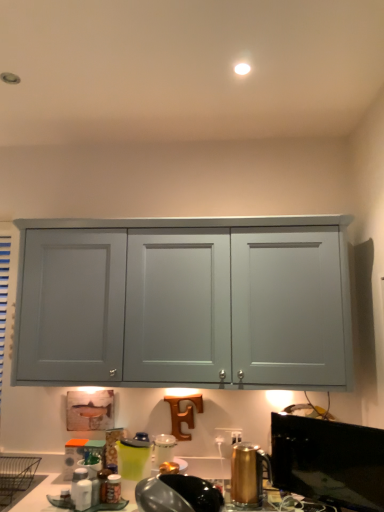
Question: From the image's perspective, relative to black glossy window screen at lower right, is matte plastic container at lower left, acting as the fourth appliance starting from the front, above or below?

Choices:
 (A) above
 (B) below

Answer: (B)

Question: Choose the correct answer: Is matte plastic container at lower left, arranged as the 1th appliance when viewed from the left, inside black glossy window screen at lower right or outside it?

Choices:
 (A) outside
 (B) inside

Answer: (A)

Question: Considering the real-world distances, which object is closest to the metallic silver toaster at lower center, the 2th appliance when ordered from right to left?

Choices:
 (A) matte plastic container at lower left, which appears as the 1th appliance when viewed from the back
 (B) black glossy window screen at lower right
 (C) gold metallic kettle at lower right, the 2th appliance viewed from the front
 (D) green plastic pitcher at lower center, acting as the second appliance starting from the left

Answer: (D)

Question: Which of these objects is positioned farthest from the gold metallic kettle at lower right, the 1th appliance in the right-to-left sequence?

Choices:
 (A) matte plastic container at lower left, arranged as the 1th appliance when viewed from the left
 (B) green plastic pitcher at lower center, the 3th appliance when ordered from right to left
 (C) black glossy window screen at lower right
 (D) metallic silver toaster at lower center, which is the 4th appliance from back to front

Answer: (A)